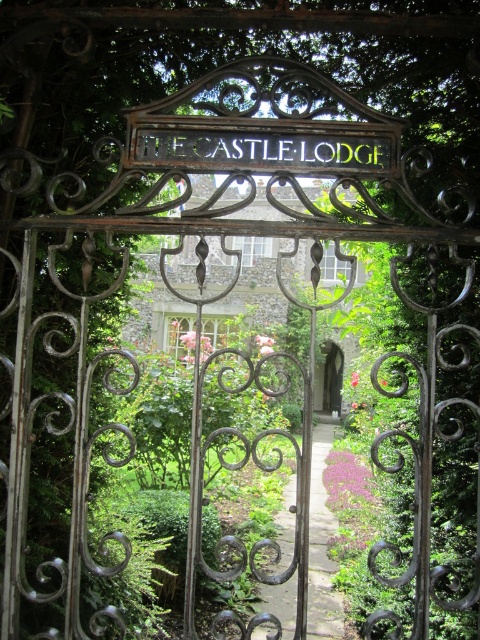
Question: Is gold metallic sign at center bigger than smooth stone archway at center?

Choices:
 (A) no
 (B) yes

Answer: (A)

Question: Among these points, which one is farthest from the camera?

Choices:
 (A) (336, 404)
 (B) (220, 147)

Answer: (A)

Question: Is the position of gold metallic sign at center more distant than that of smooth stone archway at center?

Choices:
 (A) no
 (B) yes

Answer: (A)

Question: Does gold metallic sign at center have a smaller size compared to smooth stone archway at center?

Choices:
 (A) yes
 (B) no

Answer: (A)